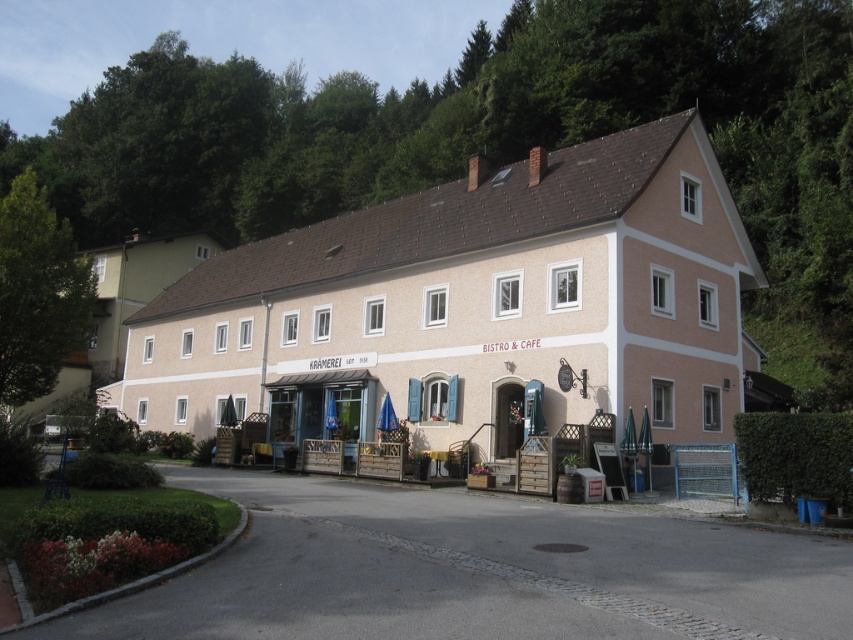
In the scene shown: Does light pink stucco building at center have a lesser height compared to white painted wood building at lower left?

Yes, light pink stucco building at center is shorter than white painted wood building at lower left.

Is point (527, 225) positioned before point (142, 280)?

Yes, point (527, 225) is in front of point (142, 280).

This screenshot has height=640, width=853. I want to click on light pink stucco building at center, so click(x=474, y=305).